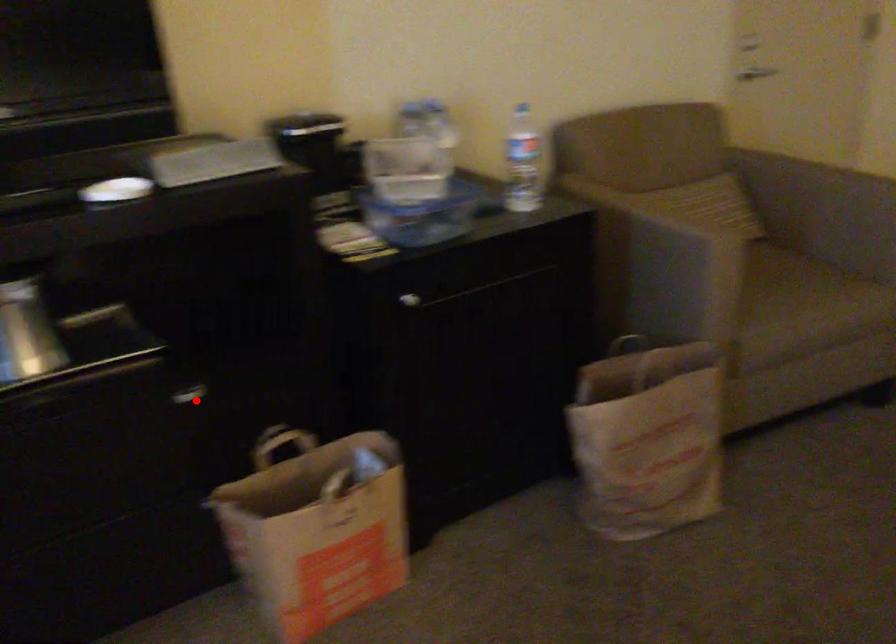
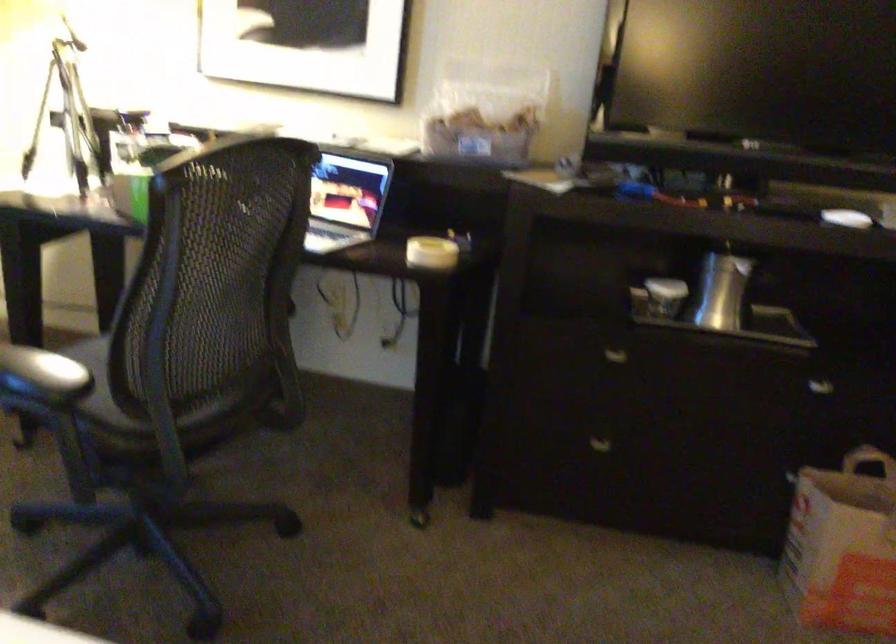
Question: I am providing you with two images of the same scene from different viewpoints. Image1 has a red point marked. In image2, the corresponding 3D location appears at what relative position? Reply with the corresponding letter.

Choices:
 (A) Closer
 (B) Farther

Answer: (B)